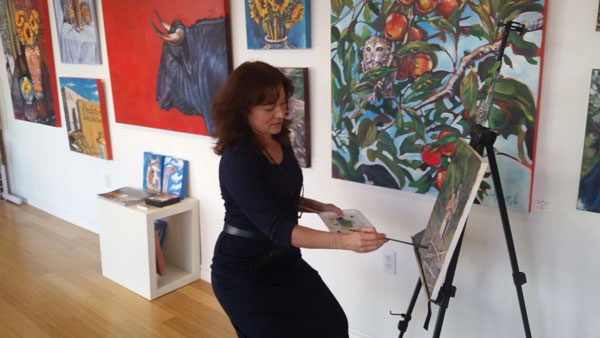
You are a GUI agent. You are given a task and a screenshot of the screen. Output one action in this format:
    pyautogui.click(x=<x>, y=<y>)
    Task: Click on the canvas
    This screenshot has height=338, width=600.
    Given the screenshot: What is the action you would take?
    pyautogui.click(x=445, y=276), pyautogui.click(x=307, y=37), pyautogui.click(x=318, y=105), pyautogui.click(x=108, y=100), pyautogui.click(x=98, y=49), pyautogui.click(x=51, y=76), pyautogui.click(x=590, y=147), pyautogui.click(x=592, y=30), pyautogui.click(x=542, y=103)